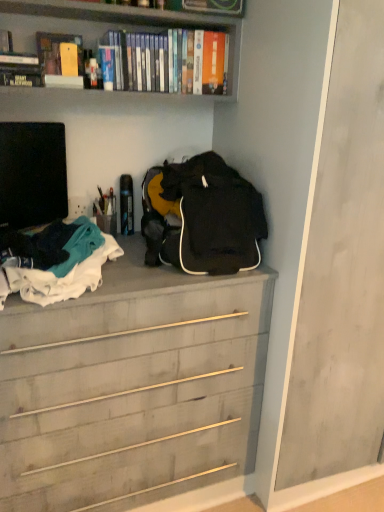
The height and width of the screenshot is (512, 384). I want to click on wooden chest of drawers at center, so click(132, 387).

How much space does hardcover book at upper left, positioned as the third book in right-to-left order, occupy vertically?

It is 3.95 inches.

This screenshot has height=512, width=384. What do you see at coordinates (32, 174) in the screenshot?
I see `black matte television at left` at bounding box center [32, 174].

Locate an element on the screen. black matte television at left is located at coordinates (32, 174).

Locate an element on the screen. The image size is (384, 512). wooden chest of drawers at center is located at coordinates (132, 387).

From a real-world perspective, which is physically above, black matte television at left or wooden chest of drawers at center?

black matte television at left, from a real-world perspective.

Which object is closer to the camera, black matte television at left or wooden chest of drawers at center?

wooden chest of drawers at center is closer to the camera.

Is black matte television at left wider or thinner than wooden chest of drawers at center?

black matte television at left is thinner than wooden chest of drawers at center.

Is white cotton clothes at left to the right of matte yellow book at upper left, which is the 2th book in right-to-left order, from the viewer's perspective?

Yes.

Which is farther, (80,263) or (56,37)?

Point (56,37)

Could you tell me if white cotton clothes at left is facing matte yellow book at upper left, which is the 2th book in right-to-left order?

No, white cotton clothes at left is not aimed at matte yellow book at upper left, which is the 2th book in right-to-left order.

From a real-world perspective, is white cotton clothes at left below matte yellow book at upper left, which is the 2th book in right-to-left order?

Correct, in the physical world, white cotton clothes at left is lower than matte yellow book at upper left, which is the 2th book in right-to-left order.

Is point (8, 177) closer or farther from the camera than point (211, 220)?

Point (8, 177).

Is black matte television at left positioned with its back to black matte backpack at center?

No, black matte television at left's orientation is not away from black matte backpack at center.

From the picture: From the image's perspective, is black matte television at left over black matte backpack at center?

Indeed, from the image's perspective, black matte television at left is shown above black matte backpack at center.

Could you tell me if hardcover book at upper left, positioned as the third book in right-to-left order, is turned towards hardcover book at upper left, which appears as the fourth book when viewed from the right?

No, hardcover book at upper left, positioned as the third book in right-to-left order, is not turned towards hardcover book at upper left, which appears as the fourth book when viewed from the right.

From a real-world perspective, is hardcover book at upper left, the 2th book from the left, positioned above or below hardcover book at upper left, which appears as the fourth book when viewed from the right?

hardcover book at upper left, the 2th book from the left, is below hardcover book at upper left, which appears as the fourth book when viewed from the right.

Is matte yellow book at upper left, placed as the 3th book when sorted from left to right, wider or thinner than wooden chest of drawers at center?

Considering their sizes, matte yellow book at upper left, placed as the 3th book when sorted from left to right, looks slimmer than wooden chest of drawers at center.

Does matte yellow book at upper left, placed as the 3th book when sorted from left to right, have a smaller size compared to wooden chest of drawers at center?

Yes, matte yellow book at upper left, placed as the 3th book when sorted from left to right, is smaller than wooden chest of drawers at center.

Locate an element on the screen. book that is the 2nd object above the wooden chest of drawers at center (from a real-world perspective) is located at coordinates (56, 50).

In the image, is wooden chest of drawers at center positioned in front of or behind hardcover book at upper left, which appears as the fourth book when viewed from the right?

Clearly, wooden chest of drawers at center is in front of hardcover book at upper left, which appears as the fourth book when viewed from the right.

Could you tell me if wooden chest of drawers at center is turned towards hardcover book at upper left, which appears as the fourth book when viewed from the right?

No.

Identify the location of the 3rd book counting from the left of the wooden chest of drawers at center. (x=6, y=41).

From the image's perspective, would you say wooden chest of drawers at center is positioned over hardcover book at upper left, which appears as the fourth book when viewed from the right?

No, from the image's perspective, wooden chest of drawers at center is not over hardcover book at upper left, which appears as the fourth book when viewed from the right.

From the image's perspective, is matte yellow book at upper left, placed as the 3th book when sorted from left to right, above or below hardcover book at upper left, which is the 1th book in left-to-right order?

Clearly, from the image's perspective, matte yellow book at upper left, placed as the 3th book when sorted from left to right, is below hardcover book at upper left, which is the 1th book in left-to-right order.

Is matte yellow book at upper left, which is the 2th book in right-to-left order, looking in the opposite direction of hardcover book at upper left, which is the 1th book in left-to-right order?

No, hardcover book at upper left, which is the 1th book in left-to-right order, is not at the back of matte yellow book at upper left, which is the 2th book in right-to-left order.

How much distance is there between matte yellow book at upper left, placed as the 3th book when sorted from left to right, and hardcover book at upper left, which is the 1th book in left-to-right order?

matte yellow book at upper left, placed as the 3th book when sorted from left to right, is 5.71 inches from hardcover book at upper left, which is the 1th book in left-to-right order.

In terms of width, does matte yellow book at upper left, placed as the 3th book when sorted from left to right, look wider or thinner when compared to hardcover book at upper left, which is the 1th book in left-to-right order?

Clearly, matte yellow book at upper left, placed as the 3th book when sorted from left to right, has more width compared to hardcover book at upper left, which is the 1th book in left-to-right order.

Locate an element on the screen. This screenshot has height=512, width=384. television behind the wooden chest of drawers at center is located at coordinates (32, 174).

Where is `the 2nd book above when counting from the white cotton clothes at left (from the image's perspective)`? the 2nd book above when counting from the white cotton clothes at left (from the image's perspective) is located at coordinates (56, 50).

When comparing their distances from white cotton clothes at left, does matte yellow book at upper left, placed as the 3th book when sorted from left to right, or hardcover book at upper left, which appears as the fourth book when viewed from the right, seem further?

Among the two, hardcover book at upper left, which appears as the fourth book when viewed from the right, is located further to white cotton clothes at left.

Based on their spatial positions, is white cotton clothes at left or wooden chest of drawers at center further from black matte backpack at center?

Based on the image, wooden chest of drawers at center appears to be further to black matte backpack at center.

Considering their positions, is black matte backpack at center positioned closer to white cotton clothes at left than black matte television at left?

black matte backpack at center is closer to white cotton clothes at left.

Looking at the image, which one is located further to black matte backpack at center, white cotton clothes at left or hardcover book at upper left, which is the 1th book in left-to-right order?

hardcover book at upper left, which is the 1th book in left-to-right order, lies further to black matte backpack at center than the other object.

Estimate the real-world distances between objects in this image. Which object is closer to white cotton clothes at left, hardcover book at upper left, which is the 1th book in left-to-right order, or hardcover book at upper left, positioned as the third book in right-to-left order?

hardcover book at upper left, positioned as the third book in right-to-left order.

Considering their positions, is matte yellow book at upper left, which is the 2th book in right-to-left order, positioned further to wooden chest of drawers at center than white cotton clothes at left?

The object further to wooden chest of drawers at center is matte yellow book at upper left, which is the 2th book in right-to-left order.

Based on their spatial positions, is matte yellow book at upper left, placed as the 3th book when sorted from left to right, or hardcover book at upper left, positioned as the third book in right-to-left order, further from black matte backpack at center?

hardcover book at upper left, positioned as the third book in right-to-left order, is further to black matte backpack at center.

When comparing their distances from hardcover book at upper left, the 2th book from the left, does black matte backpack at center or matte yellow book at upper left, placed as the 3th book when sorted from left to right, seem further?

black matte backpack at center lies further to hardcover book at upper left, the 2th book from the left, than the other object.

Identify the location of backpack between hardcover book at upper left, which appears as the fourth book when viewed from the right, and wooden chest of drawers at center in the up-down direction. This screenshot has width=384, height=512. (203, 217).

Identify the location of book that lies between matte yellow book at upper left, placed as the 3th book when sorted from left to right, and wooden chest of drawers at center from top to bottom. This screenshot has height=512, width=384. (17, 65).

At what (x,y) coordinates should I click in order to perform the action: click on television between hardcover book at upper left, which is the 1th book in left-to-right order, and wooden chest of drawers at center from top to bottom. Please return your answer as a coordinate pair (x, y). This screenshot has width=384, height=512. Looking at the image, I should click on (32, 174).

Locate an element on the screen. television between hardcover book at upper left, positioned as the third book in right-to-left order, and wooden chest of drawers at center, in the vertical direction is located at coordinates (32, 174).